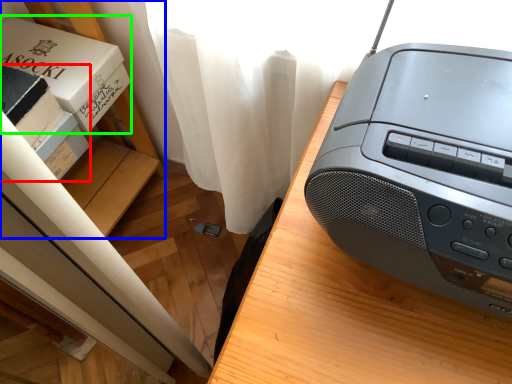
Question: Based on their relative distances, which object is farther from box (highlighted by a red box)? Choose from shelf (highlighted by a blue box) and paperback book (highlighted by a green box).

Choices:
 (A) shelf
 (B) paperback book

Answer: (A)